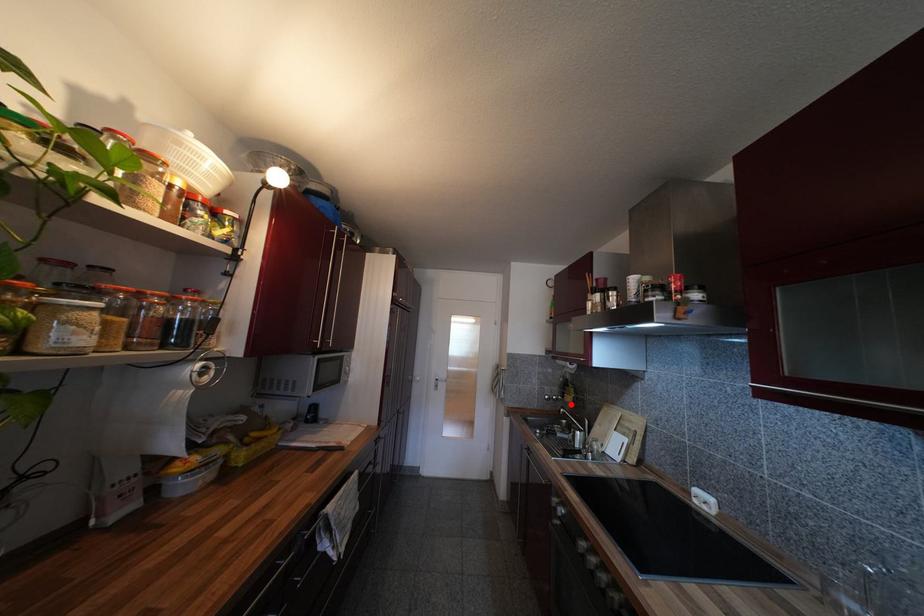
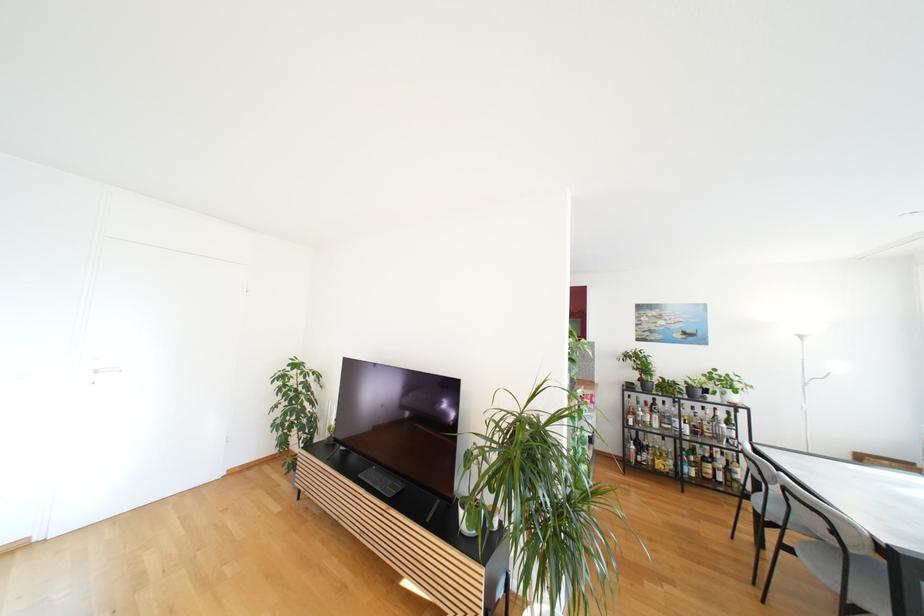
Question: I am providing you with two images of the same scene from different viewpoints. A red point is marked on the first image. Can you still see the location of the red point in image 2?

Choices:
 (A) Yes
 (B) No

Answer: (B)